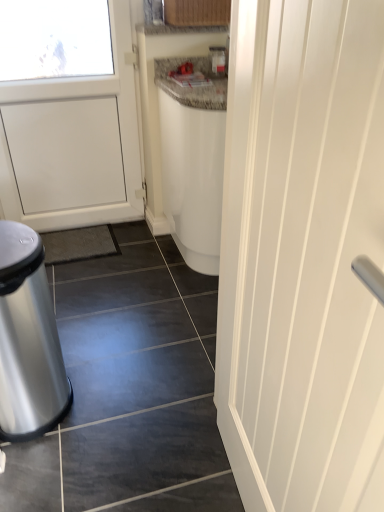
This screenshot has height=512, width=384. I want to click on polished metallic trash can at lower left, so [28, 340].

Image resolution: width=384 pixels, height=512 pixels. What do you see at coordinates (28, 340) in the screenshot?
I see `polished metallic trash can at lower left` at bounding box center [28, 340].

In order to face white smooth door at right, should I rotate leftwards or rightwards?

Rotate your view right by about 8.416°.

The image size is (384, 512). In order to click on white smooth door at right in this screenshot , I will do [302, 253].

This screenshot has width=384, height=512. Describe the element at coordinates (302, 253) in the screenshot. I see `white smooth door at right` at that location.

The height and width of the screenshot is (512, 384). In order to click on polished metallic trash can at lower left in this screenshot , I will do `click(28, 340)`.

Is polished metallic trash can at lower left to the left of white smooth door at right from the viewer's perspective?

Correct, you'll find polished metallic trash can at lower left to the left of white smooth door at right.

Which is in front, polished metallic trash can at lower left or white smooth door at right?

white smooth door at right is more forward.

Is point (40, 288) in front of point (260, 500)?

That is False.

From the image's perspective, is polished metallic trash can at lower left under white smooth door at right?

Indeed, from the image's perspective, polished metallic trash can at lower left is shown beneath white smooth door at right.

From a real-world perspective, does polished metallic trash can at lower left stand above white smooth door at right?

No, from a real-world perspective, polished metallic trash can at lower left is not on top of white smooth door at right.

Between polished metallic trash can at lower left and white smooth door at right, which one has larger width?

polished metallic trash can at lower left is wider.

Who is taller, polished metallic trash can at lower left or white smooth door at right?

white smooth door at right.

Which of these two, polished metallic trash can at lower left or white smooth door at right, is smaller?

polished metallic trash can at lower left.

Could white smooth door at right be considered to be inside polished metallic trash can at lower left?

No, white smooth door at right is located outside of polished metallic trash can at lower left.

Is polished metallic trash can at lower left not close to white smooth door at right?

No, polished metallic trash can at lower left is in close proximity to white smooth door at right.

Is polished metallic trash can at lower left aimed at white smooth door at right?

No.

How many degrees apart are the facing directions of polished metallic trash can at lower left and white smooth door at right?

The facing directions of polished metallic trash can at lower left and white smooth door at right are 86 degrees apart.

The width and height of the screenshot is (384, 512). In order to click on door on the right of the polished metallic trash can at lower left in this screenshot , I will do `click(302, 253)`.

Based on the photo, which is more to the right, white smooth door at right or polished metallic trash can at lower left?

From the viewer's perspective, white smooth door at right appears more on the right side.

Does white smooth door at right come in front of polished metallic trash can at lower left?

Yes.

Which is in front, point (332, 272) or point (17, 392)?

The point (332, 272) is closer.

From the image's perspective, would you say white smooth door at right is shown under polished metallic trash can at lower left?

Actually, white smooth door at right appears above polished metallic trash can at lower left in the image.

From a real-world perspective, relative to polished metallic trash can at lower left, is white smooth door at right vertically above or below?

In terms of real-world spatial position, white smooth door at right is above polished metallic trash can at lower left.

In terms of width, does white smooth door at right look wider or thinner when compared to polished metallic trash can at lower left?

white smooth door at right is thinner than polished metallic trash can at lower left.

Considering the sizes of objects white smooth door at right and polished metallic trash can at lower left in the image provided, who is shorter, white smooth door at right or polished metallic trash can at lower left?

Standing shorter between the two is polished metallic trash can at lower left.

Considering the sizes of objects white smooth door at right and polished metallic trash can at lower left in the image provided, who is smaller, white smooth door at right or polished metallic trash can at lower left?

polished metallic trash can at lower left.

Is white smooth door at right inside the boundaries of polished metallic trash can at lower left, or outside?

white smooth door at right is spatially situated outside polished metallic trash can at lower left.

Is the surface of white smooth door at right in direct contact with polished metallic trash can at lower left?

They are not placed beside each other.

Is white smooth door at right positioned with its back to polished metallic trash can at lower left?

No, white smooth door at right is not facing away from polished metallic trash can at lower left.

What's the angular difference between white smooth door at right and polished metallic trash can at lower left's facing directions?

The angular difference between white smooth door at right and polished metallic trash can at lower left is 86 degrees.

Where is `door above the polished metallic trash can at lower left (from the image's perspective)`? Image resolution: width=384 pixels, height=512 pixels. door above the polished metallic trash can at lower left (from the image's perspective) is located at coordinates [x=302, y=253].

Locate an element on the screen. Image resolution: width=384 pixels, height=512 pixels. door that is on the right side of polished metallic trash can at lower left is located at coordinates (302, 253).

Where is `door positioned vertically above the polished metallic trash can at lower left (from a real-world perspective)`? This screenshot has height=512, width=384. door positioned vertically above the polished metallic trash can at lower left (from a real-world perspective) is located at coordinates (302, 253).